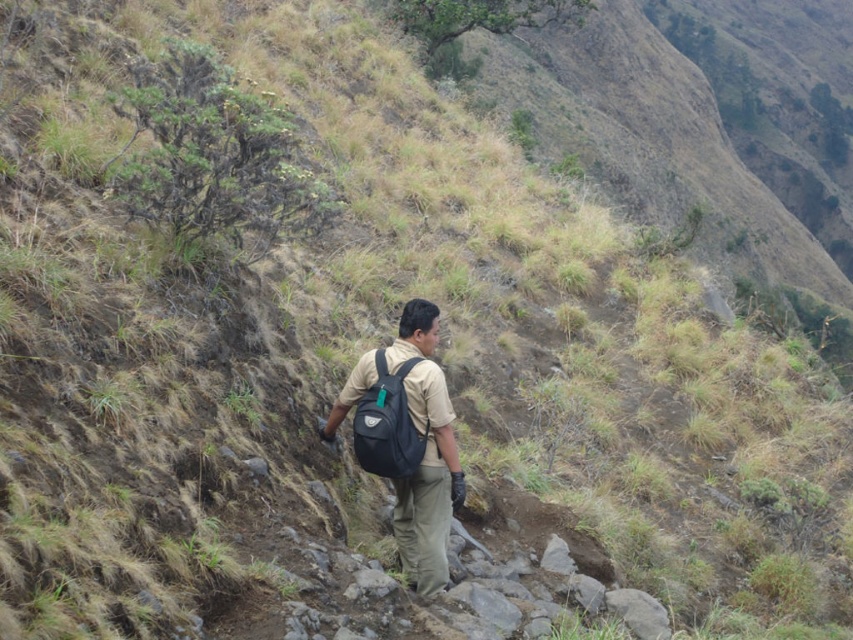
Question: Among these objects, which one is farthest from the camera?

Choices:
 (A) navy blue fabric backpack at center
 (B) matte black backpack at center

Answer: (B)

Question: Which point is farther to the camera?

Choices:
 (A) (434, 342)
 (B) (372, 390)

Answer: (A)

Question: Does matte black backpack at center have a lesser width compared to navy blue fabric backpack at center?

Choices:
 (A) yes
 (B) no

Answer: (B)

Question: Can you confirm if matte black backpack at center is wider than navy blue fabric backpack at center?

Choices:
 (A) no
 (B) yes

Answer: (B)

Question: Which point appears closest to the camera in this image?

Choices:
 (A) (440, 422)
 (B) (384, 369)

Answer: (A)

Question: Where is matte black backpack at center located in relation to navy blue fabric backpack at center in the image?

Choices:
 (A) left
 (B) right

Answer: (A)